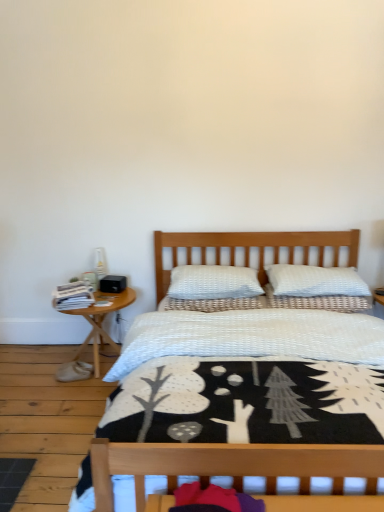
The width and height of the screenshot is (384, 512). Identify the location of white textured pillow at center, which is the second pillow in left-to-right order. (319, 302).

In order to face white textured pillow at center, the third pillow viewed from the right, should I rotate leftwards or rightwards?

Rotate your view right by about 3.144°.

Find the location of a particular element. The height and width of the screenshot is (512, 384). white textured pillow at center, the third pillow viewed from the right is located at coordinates (213, 282).

What is the approximate width of woodennightstand at left?

It is 23.47 inches.

What do you see at coordinates (101, 321) in the screenshot? This screenshot has width=384, height=512. I see `woodennightstand at left` at bounding box center [101, 321].

This screenshot has width=384, height=512. What do you see at coordinates (248, 396) in the screenshot?
I see `white textured bed at center` at bounding box center [248, 396].

Locate an element on the screen. This screenshot has height=512, width=384. white textured pillow at center, the 2th pillow from the right is located at coordinates (319, 302).

From the picture: How many degrees apart are the facing directions of white textured pillow at center, the first pillow when ordered from left to right, and white textured pillow at center, the 2th pillow from the right?

The angle between the facing direction of white textured pillow at center, the first pillow when ordered from left to right, and the facing direction of white textured pillow at center, the 2th pillow from the right, is 0.000914 degrees.

Which object is closer to the camera, white textured pillow at center, the first pillow when ordered from left to right, or white textured pillow at center, the 2th pillow from the right?

white textured pillow at center, the first pillow when ordered from left to right, is closer to the camera.

Would you say white textured pillow at center, the third pillow viewed from the right, contains white textured pillow at center, the 2th pillow from the right?

No, white textured pillow at center, the 2th pillow from the right, is not a part of white textured pillow at center, the third pillow viewed from the right.

Is white textured pillow at center, the third pillow viewed from the right, taller or shorter than white textured pillow at center, the 2th pillow from the right?

Considering their sizes, white textured pillow at center, the third pillow viewed from the right, has more height than white textured pillow at center, the 2th pillow from the right.

From the image's perspective, is white textured pillow at center, the first pillow when ordered from left to right, located above or below white textured pillow at upper center, which is counted as the 1th pillow, starting from the right?

white textured pillow at center, the first pillow when ordered from left to right, is situated lower than white textured pillow at upper center, which is counted as the 1th pillow, starting from the right, in the image.

Can you confirm if white textured pillow at center, the third pillow viewed from the right, is wider than white textured pillow at upper center, which is counted as the 1th pillow, starting from the right?

Yes.

Is white textured pillow at center, the first pillow when ordered from left to right, positioned with its back to white textured pillow at upper center, which is counted as the 1th pillow, starting from the right?

No.

Does point (236, 273) come behind point (330, 280)?

Yes, it is.

In the scene shown: Between white textured pillow at upper center, which is counted as the 1th pillow, starting from the right, and white textured pillow at center, which is the second pillow in left-to-right order, which one has larger width?

With larger width is white textured pillow at upper center, which is counted as the 1th pillow, starting from the right.

Is white textured pillow at upper center, acting as the third pillow starting from the left, next to white textured pillow at center, which is the second pillow in left-to-right order, and touching it?

Yes, white textured pillow at upper center, acting as the third pillow starting from the left, and white textured pillow at center, which is the second pillow in left-to-right order, clearly make contact.

Is white textured pillow at upper center, acting as the third pillow starting from the left, to the left or to the right of white textured pillow at center, which is the second pillow in left-to-right order, in the image?

Based on their positions, white textured pillow at upper center, acting as the third pillow starting from the left, is located to the right of white textured pillow at center, which is the second pillow in left-to-right order.

Does white textured pillow at center, the 2th pillow from the right, appear on the left side of white textured pillow at upper center, acting as the third pillow starting from the left?

Correct, you'll find white textured pillow at center, the 2th pillow from the right, to the left of white textured pillow at upper center, acting as the third pillow starting from the left.

Is white textured pillow at center, the 2th pillow from the right, facing away from white textured pillow at upper center, acting as the third pillow starting from the left?

No, white textured pillow at upper center, acting as the third pillow starting from the left, is not at the back of white textured pillow at center, the 2th pillow from the right.

Looking at this image, considering the relative sizes of white textured pillow at center, which is the second pillow in left-to-right order, and white textured pillow at upper center, which is counted as the 1th pillow, starting from the right, in the image provided, is white textured pillow at center, which is the second pillow in left-to-right order, shorter than white textured pillow at upper center, which is counted as the 1th pillow, starting from the right,?

Indeed, white textured pillow at center, which is the second pillow in left-to-right order, has a lesser height compared to white textured pillow at upper center, which is counted as the 1th pillow, starting from the right.

Is white textured pillow at center, the 2th pillow from the right, smaller than white textured pillow at upper center, which is counted as the 1th pillow, starting from the right?

Correct, white textured pillow at center, the 2th pillow from the right, occupies less space than white textured pillow at upper center, which is counted as the 1th pillow, starting from the right.

From the image's perspective, which one is positioned higher, woodennightstand at left or white textured pillow at center, the 2th pillow from the right?

white textured pillow at center, the 2th pillow from the right, is shown above in the image.

Is woodennightstand at left positioned with its back to white textured pillow at center, the 2th pillow from the right?

woodennightstand at left does not have its back to white textured pillow at center, the 2th pillow from the right.

Does woodennightstand at left contain white textured pillow at center, the 2th pillow from the right?

That's incorrect, white textured pillow at center, the 2th pillow from the right, is not inside woodennightstand at left.

Between woodennightstand at left and white textured pillow at center, the 2th pillow from the right, which one is positioned behind?

Positioned behind is white textured pillow at center, the 2th pillow from the right.

Which point is more distant from viewer, (x=313, y=283) or (x=251, y=279)?

Positioned behind is point (x=251, y=279).

Which object is positioned more to the right, white textured pillow at upper center, which is counted as the 1th pillow, starting from the right, or white textured pillow at center, the third pillow viewed from the right?

From the viewer's perspective, white textured pillow at upper center, which is counted as the 1th pillow, starting from the right, appears more on the right side.

Could you tell me if white textured pillow at upper center, acting as the third pillow starting from the left, is facing white textured pillow at center, the third pillow viewed from the right?

No, white textured pillow at upper center, acting as the third pillow starting from the left, does not turn towards white textured pillow at center, the third pillow viewed from the right.

Is white textured pillow at upper center, acting as the third pillow starting from the left, closer to the viewer compared to white textured pillow at center, the first pillow when ordered from left to right?

Yes, it is.

Is white textured pillow at center, the 2th pillow from the right, with woodennightstand at left?

No, white textured pillow at center, the 2th pillow from the right, is not next to woodennightstand at left.

From the image's perspective, who appears lower, white textured pillow at center, which is the second pillow in left-to-right order, or woodennightstand at left?

woodennightstand at left, from the image's perspective.

Does point (350, 303) come closer to viewer compared to point (67, 313)?

Yes, it is.

Would you say white textured pillow at center, which is the second pillow in left-to-right order, is outside woodennightstand at left?

Absolutely, white textured pillow at center, which is the second pillow in left-to-right order, is external to woodennightstand at left.

Find the location of a particular element. The height and width of the screenshot is (512, 384). pillow located behind the white textured pillow at center, the first pillow when ordered from left to right is located at coordinates pos(319,302).

The width and height of the screenshot is (384, 512). I want to click on pillow above the white textured pillow at center, the third pillow viewed from the right (from the image's perspective), so click(x=315, y=281).

When comparing their distances from white textured pillow at upper center, which is counted as the 1th pillow, starting from the right, does white textured pillow at center, the first pillow when ordered from left to right, or white textured pillow at center, the 2th pillow from the right, seem closer?

white textured pillow at center, the 2th pillow from the right.

From the image, which object appears to be nearer to white textured pillow at center, the third pillow viewed from the right, white textured pillow at upper center, acting as the third pillow starting from the left, or white textured pillow at center, which is the second pillow in left-to-right order?

white textured pillow at center, which is the second pillow in left-to-right order.

From the image, which object appears to be farther from white textured pillow at center, the third pillow viewed from the right, white textured pillow at upper center, acting as the third pillow starting from the left, or white textured bed at center?

The object further to white textured pillow at center, the third pillow viewed from the right, is white textured bed at center.

Estimate the real-world distances between objects in this image. Which object is closer to white textured pillow at upper center, acting as the third pillow starting from the left, white textured pillow at center, the third pillow viewed from the right, or white textured bed at center?

white textured pillow at center, the third pillow viewed from the right, is positioned closer to the anchor white textured pillow at upper center, acting as the third pillow starting from the left.

Considering their positions, is woodennightstand at left positioned closer to white textured bed at center than white textured pillow at center, the third pillow viewed from the right?

Among the two, white textured pillow at center, the third pillow viewed from the right, is located nearer to white textured bed at center.

When comparing their distances from white textured bed at center, does white textured pillow at center, the third pillow viewed from the right, or woodennightstand at left seem further?

The object further to white textured bed at center is woodennightstand at left.

Which object lies further to the anchor point white textured pillow at center, the 2th pillow from the right, white textured pillow at upper center, acting as the third pillow starting from the left, or white textured pillow at center, the third pillow viewed from the right?

Among the two, white textured pillow at center, the third pillow viewed from the right, is located further to white textured pillow at center, the 2th pillow from the right.

From the picture: Considering their positions, is white textured pillow at center, which is the second pillow in left-to-right order, positioned further to woodennightstand at left than white textured bed at center?

white textured pillow at center, which is the second pillow in left-to-right order, is further to woodennightstand at left.

Where is `pillow located between white textured pillow at center, the third pillow viewed from the right, and white textured pillow at upper center, acting as the third pillow starting from the left, in the left-right direction`? pillow located between white textured pillow at center, the third pillow viewed from the right, and white textured pillow at upper center, acting as the third pillow starting from the left, in the left-right direction is located at coordinates (319, 302).

Locate an element on the screen. The width and height of the screenshot is (384, 512). nightstand between white textured bed at center and white textured pillow at center, the 2th pillow from the right, along the z-axis is located at coordinates (101, 321).

The height and width of the screenshot is (512, 384). Identify the location of nightstand located between white textured bed at center and white textured pillow at center, the first pillow when ordered from left to right, in the depth direction. (101, 321).

Where is `pillow between woodennightstand at left and white textured pillow at center, the 2th pillow from the right`? The width and height of the screenshot is (384, 512). pillow between woodennightstand at left and white textured pillow at center, the 2th pillow from the right is located at coordinates (213, 282).